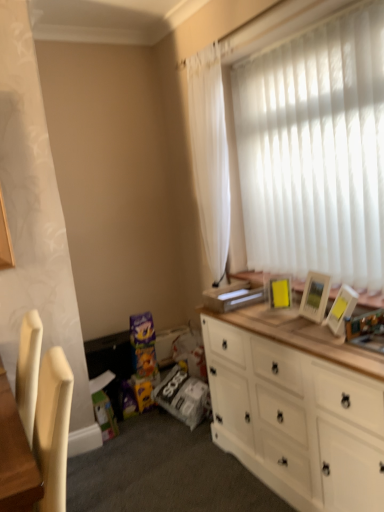
Question: From the image's perspective, would you say white sheer curtain at upper right is positioned over white glossy picture frame at upper right, the first picture frame in the right-to-left sequence?

Choices:
 (A) yes
 (B) no

Answer: (A)

Question: From a real-world perspective, is white sheer curtain at upper right on top of white glossy picture frame at upper right, which is the second picture frame in back-to-front order?

Choices:
 (A) yes
 (B) no

Answer: (A)

Question: Can you confirm if white sheer curtain at upper right is taller than white glossy picture frame at upper right, which is the second picture frame in back-to-front order?

Choices:
 (A) no
 (B) yes

Answer: (B)

Question: Considering the relative positions of white sheer curtain at upper right and white glossy picture frame at upper right, which is the second picture frame in back-to-front order, in the image provided, is white sheer curtain at upper right behind white glossy picture frame at upper right, which is the second picture frame in back-to-front order,?

Choices:
 (A) yes
 (B) no

Answer: (A)

Question: Is white sheer curtain at upper right at the right side of white glossy picture frame at upper right, the first picture frame in the right-to-left sequence?

Choices:
 (A) yes
 (B) no

Answer: (B)

Question: From their relative heights in the image, would you say white wood cabinet at right is taller or shorter than yellow matte picture frame at upper right, which appears as the 1th picture frame when viewed from the back?

Choices:
 (A) tall
 (B) short

Answer: (A)

Question: From the image's perspective, is white wood cabinet at right positioned above or below yellow matte picture frame at upper right, the first picture frame from the left?

Choices:
 (A) below
 (B) above

Answer: (A)

Question: Looking at their shapes, would you say white wood cabinet at right is wider or thinner than yellow matte picture frame at upper right, which appears as the second picture frame when viewed from the front?

Choices:
 (A) thin
 (B) wide

Answer: (B)

Question: Looking at the image, does white wood cabinet at right seem bigger or smaller compared to yellow matte picture frame at upper right, the second picture frame in the right-to-left sequence?

Choices:
 (A) big
 (B) small

Answer: (A)

Question: From a real-world perspective, relative to white wood cabinet at right, is yellow matte picture frame at upper right, the first picture frame from the left, vertically above or below?

Choices:
 (A) above
 (B) below

Answer: (A)

Question: Is point (281, 288) closer or farther from the camera than point (332, 406)?

Choices:
 (A) closer
 (B) farther

Answer: (B)

Question: Considering the positions of yellow matte picture frame at upper right, the first picture frame from the left, and white wood cabinet at right in the image, is yellow matte picture frame at upper right, the first picture frame from the left, bigger or smaller than white wood cabinet at right?

Choices:
 (A) small
 (B) big

Answer: (A)

Question: Based on their positions, is yellow matte picture frame at upper right, which appears as the 1th picture frame when viewed from the back, located to the left or right of white wood cabinet at right?

Choices:
 (A) right
 (B) left

Answer: (B)

Question: In terms of height, does yellow matte picture frame at upper right, the first picture frame from the left, look taller or shorter compared to white glossy picture frame at upper right, which is counted as the 1th picture frame, starting from the front?

Choices:
 (A) tall
 (B) short

Answer: (A)

Question: In terms of size, does yellow matte picture frame at upper right, the first picture frame from the left, appear bigger or smaller than white glossy picture frame at upper right, which is counted as the 1th picture frame, starting from the front?

Choices:
 (A) big
 (B) small

Answer: (B)